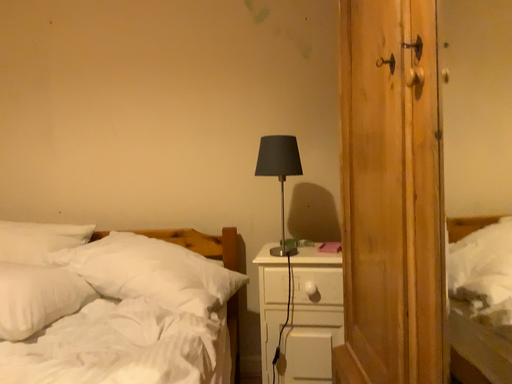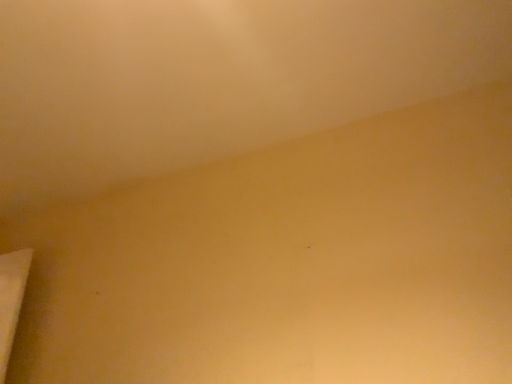
Question: How did the camera likely rotate when shooting the video?

Choices:
 (A) rotated upward
 (B) rotated downward

Answer: (A)